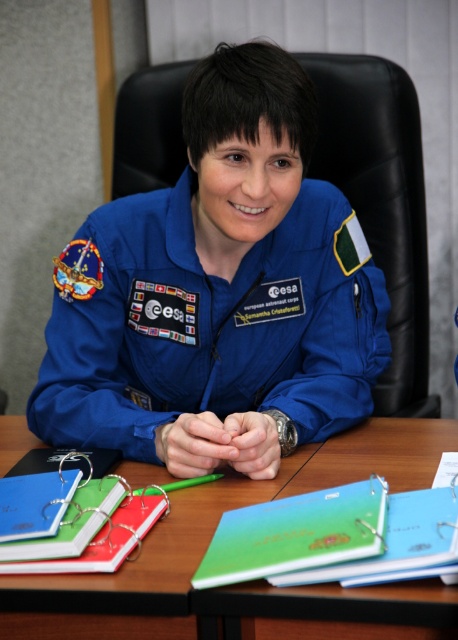
Does blue fabric astronaut suit at center lie behind wooden table at center?

Yes, it is behind wooden table at center.

From the picture: Which of these two, blue fabric astronaut suit at center or wooden table at center, stands taller?

Standing taller between the two is blue fabric astronaut suit at center.

Is point (255, 368) farther from camera compared to point (223, 604)?

Yes.

At what (x,y) coordinates should I click in order to perform the action: click on blue fabric astronaut suit at center. Please return your answer as a coordinate pair (x, y). The image size is (458, 640). Looking at the image, I should click on click(x=210, y=324).

Does wooden table at center have a lesser width compared to green matte binder at center?

In fact, wooden table at center might be wider than green matte binder at center.

Can you confirm if wooden table at center is shorter than green matte binder at center?

In fact, wooden table at center may be taller than green matte binder at center.

Locate an element on the screen. This screenshot has width=458, height=640. wooden table at center is located at coordinates (255, 580).

Is point (72, 294) positioned behind point (321, 512)?

Yes, point (72, 294) is farther from viewer.

Measure the distance between blue fabric astronaut suit at center and camera.

blue fabric astronaut suit at center and camera are 3.67 feet apart from each other.

Identify the location of blue fabric astronaut suit at center. This screenshot has height=640, width=458. (210, 324).